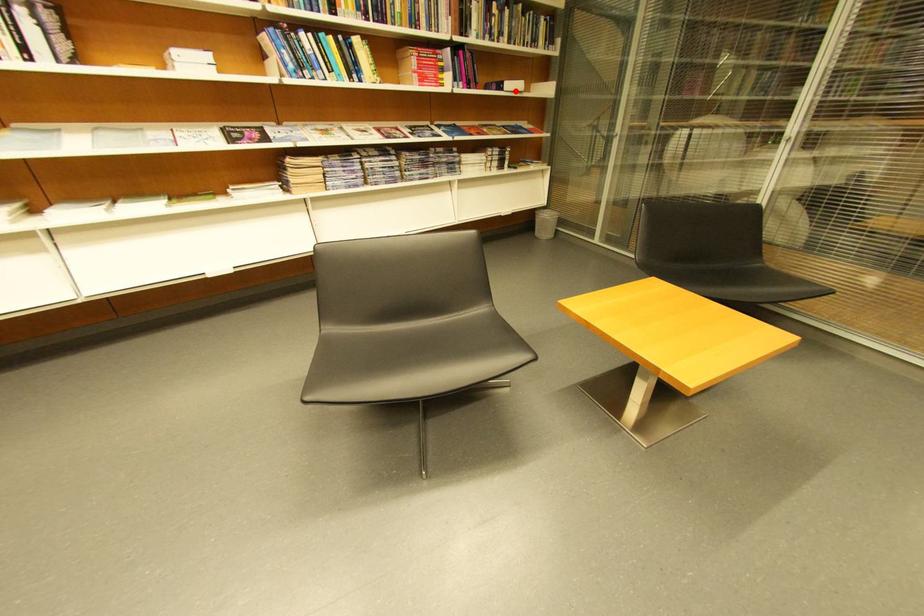
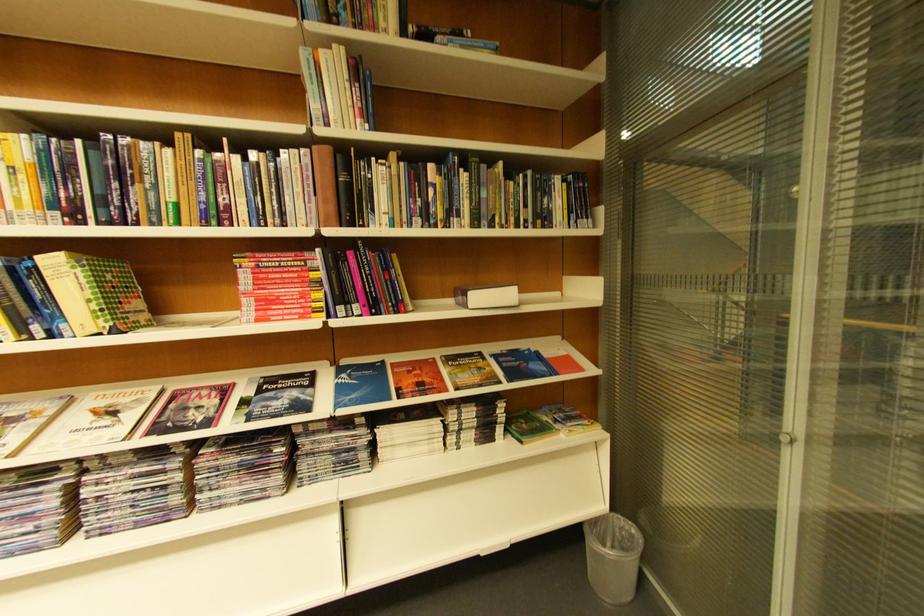
Question: I am providing you with two images of the same scene from different viewpoints. A red point is shown in image1. For the corresponding object point in image2, is it positioned nearer or farther from the camera?

Choices:
 (A) Nearer
 (B) Farther

Answer: (B)